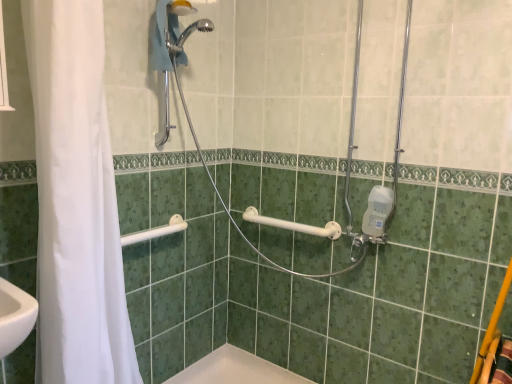
Question: Does chrome metallic shower head at upper center, positioned as the 1th shower in top-to-bottom order, have a lesser height compared to metallic silver shower at center, positioned as the second shower in top-to-bottom order?

Choices:
 (A) yes
 (B) no

Answer: (A)

Question: Can you confirm if chrome metallic shower head at upper center, positioned as the 1th shower in top-to-bottom order, is positioned to the left of metallic silver shower at center, the 2th shower positioned from the bottom?

Choices:
 (A) no
 (B) yes

Answer: (B)

Question: Can you confirm if chrome metallic shower head at upper center, the third shower positioned from the bottom, is positioned to the right of metallic silver shower at center, positioned as the second shower in top-to-bottom order?

Choices:
 (A) no
 (B) yes

Answer: (A)

Question: From a real-world perspective, is chrome metallic shower head at upper center, positioned as the 1th shower in top-to-bottom order, located higher than metallic silver shower at center, the 2th shower positioned from the bottom?

Choices:
 (A) yes
 (B) no

Answer: (A)

Question: Is chrome metallic shower head at upper center, the third shower positioned from the bottom, outside of metallic silver shower at center, the 2th shower positioned from the bottom?

Choices:
 (A) yes
 (B) no

Answer: (A)

Question: Is chrome metallic shower head at upper center, the third shower positioned from the bottom, thinner than metallic silver shower at center, the 2th shower positioned from the bottom?

Choices:
 (A) no
 (B) yes

Answer: (B)

Question: From the image's perspective, would you say white plastic grab bar at upper left, the 1th shower in the bottom-to-top sequence, is positioned over metallic silver shower at center, the 2th shower positioned from the bottom?

Choices:
 (A) no
 (B) yes

Answer: (A)

Question: From a real-world perspective, is white plastic grab bar at upper left, which is the third shower from top to bottom, positioned over metallic silver shower at center, the 2th shower positioned from the bottom, based on gravity?

Choices:
 (A) yes
 (B) no

Answer: (B)

Question: Does white plastic grab bar at upper left, the 1th shower in the bottom-to-top sequence, have a greater width compared to metallic silver shower at center, the 2th shower positioned from the bottom?

Choices:
 (A) yes
 (B) no

Answer: (B)

Question: Are white plastic grab bar at upper left, which is the third shower from top to bottom, and metallic silver shower at center, positioned as the second shower in top-to-bottom order, beside each other?

Choices:
 (A) no
 (B) yes

Answer: (A)

Question: From the image's perspective, is white plastic grab bar at upper left, the 1th shower in the bottom-to-top sequence, beneath metallic silver shower at center, the 2th shower positioned from the bottom?

Choices:
 (A) yes
 (B) no

Answer: (A)

Question: Is white plastic grab bar at upper left, the 1th shower in the bottom-to-top sequence, in front of metallic silver shower at center, positioned as the second shower in top-to-bottom order?

Choices:
 (A) no
 (B) yes

Answer: (A)

Question: Does chrome metallic shower head at upper center, the third shower positioned from the bottom, touch white plastic grab bar at upper left, the 1th shower in the bottom-to-top sequence?

Choices:
 (A) yes
 (B) no

Answer: (B)